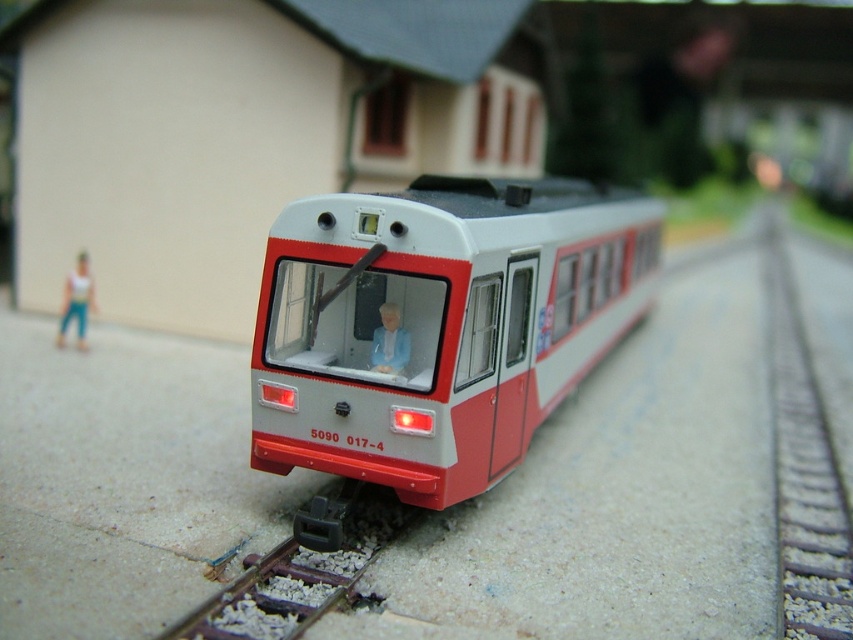
You are a model train enthusiast examining the miniature model train scene. You notice a point marked at coordinates (300, 566). What does this point indicate in the scene?

The point at (300, 566) marks the location of the metal smooth track at lower center in the scene.

You are a model train enthusiast examining the miniature model train scene. You notice a specific point at coordinates point (300, 566). What object in the scene is located at that point?

The point (300, 566) corresponds to metal smooth track at lower center.

You are a model train enthusiast who wants to place a new train car in the scene. The existing train car is at point (804, 468). Where should you place the new car to ensure it connects properly with the existing one?

The existing train car is at point (804, 468), so you should place the new car along the smooth metal train track at center to ensure proper connection.